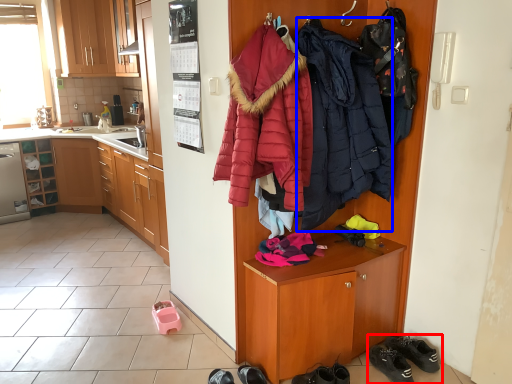
Question: Which object appears closest to the camera in this image, footwear (highlighted by a red box) or jacket (highlighted by a blue box)?

Choices:
 (A) footwear
 (B) jacket

Answer: (B)